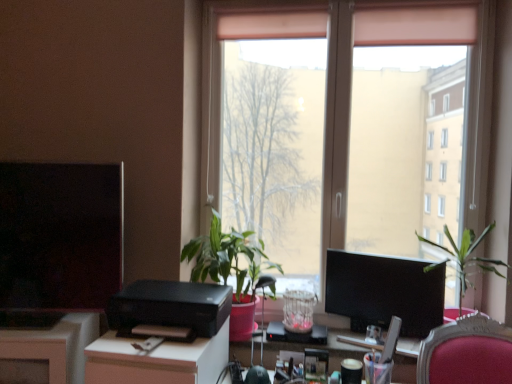
Question: From the image's perspective, is green leafy plant at right, the 1th houseplant in the right-to-left sequence, above or below green matte plant at center, placed as the second houseplant when sorted from right to left?

Choices:
 (A) below
 (B) above

Answer: (A)

Question: Would you say green leafy plant at right, which is counted as the 2th houseplant, starting from the left, is to the left or to the right of green matte plant at center, placed as the second houseplant when sorted from right to left, in the picture?

Choices:
 (A) right
 (B) left

Answer: (A)

Question: Considering the real-world distances, which object is farthest from the green leafy plant at right, which is counted as the 2th houseplant, starting from the left?

Choices:
 (A) white glossy desk at center
 (B) black plastic computer desk at center
 (C) black plastic printer at center
 (D) translucent glass vase at center
 (E) transparent glass window at center

Answer: (A)

Question: Which object is the closest to the green leafy plant at right, which is counted as the 2th houseplant, starting from the left?

Choices:
 (A) green matte plant at center, arranged as the first houseplant when viewed from the left
 (B) black plastic printer at center
 (C) matte black monitor at center right, acting as the 1th computer monitor starting from the right
 (D) white glossy desk at center
 (E) black plastic computer desk at center

Answer: (C)